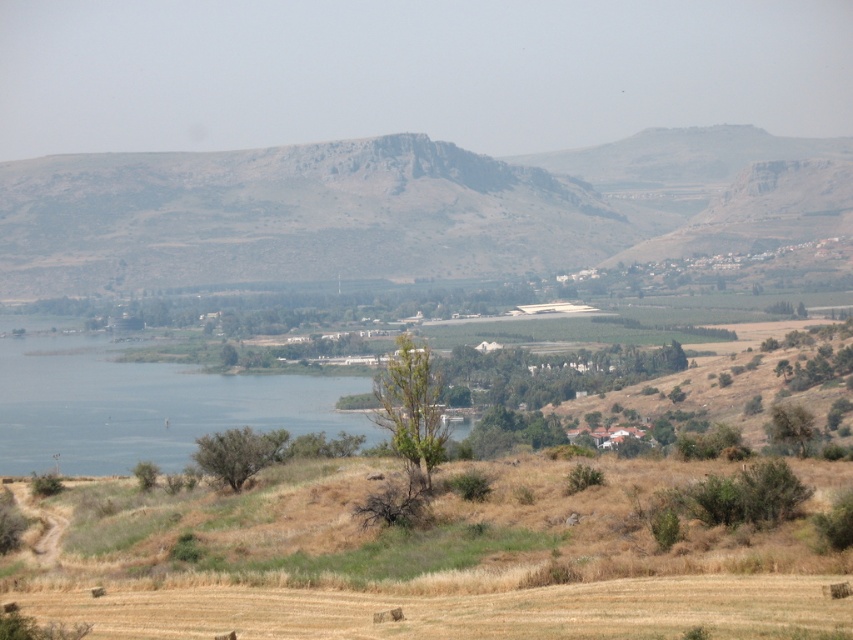
You are a hiker standing at the edge of the rugged stone mountain at center and the blue water at center. Which object would you need to look up to see?

The rugged stone mountain at center is taller than blue water at center, so you would need to look up to see the rugged stone mountain at center.

You are a hiker trying to cross the rugged stone mountain at center and the blue water at center. Which path would require more horizontal space to navigate around?

The rugged stone mountain at center might be wider than blue water at center, so the mountain path would require more horizontal space to navigate around.